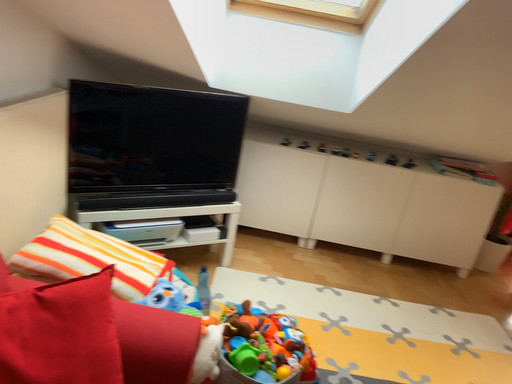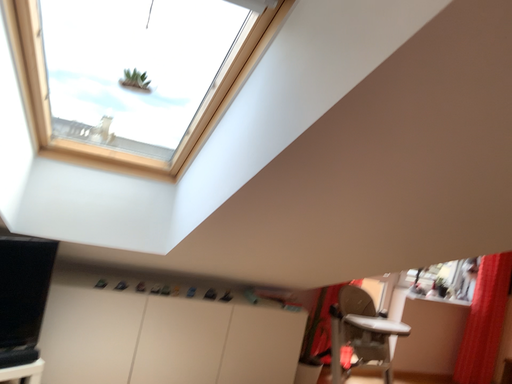
Question: How did the camera likely rotate when shooting the video?

Choices:
 (A) rotated right
 (B) rotated left

Answer: (A)